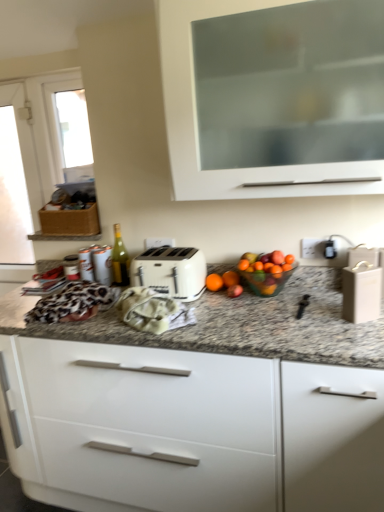
This screenshot has width=384, height=512. Describe the element at coordinates (120, 259) in the screenshot. I see `green glass bottle at center` at that location.

Find the location of `green glass bottle at center`. green glass bottle at center is located at coordinates (120, 259).

How much space does white plastic electric outlet at center, arranged as the first electric outlet when viewed from the back, occupy vertically?

white plastic electric outlet at center, arranged as the first electric outlet when viewed from the back, is 2.19 inches in height.

Measure the distance between point [303,252] and camera.

Point [303,252] and camera are 1.84 meters apart from each other.

At what (x,y) coordinates should I click in order to perform the action: click on white plastic electric outlet at upper right, which is counted as the first electric outlet, starting from the right. Please return your answer as a coordinate pair (x, y). The width and height of the screenshot is (384, 512). Looking at the image, I should click on (313, 248).

Locate an element on the screen. Image resolution: width=384 pixels, height=512 pixels. translucent glass bowl at center is located at coordinates (267, 271).

In order to face orange matte at center, should I rotate leftwards or rightwards?

Turn right approximately 4.250 degrees to face it.

Measure the distance between orange matte at center and camera.

5.83 feet.

Image resolution: width=384 pixels, height=512 pixels. In order to click on green glass bottle at center in this screenshot , I will do click(120, 259).

Which of these two, white matte cabinet at upper center, the 1th cabinetry viewed from the top, or beige matte wine box at right, the second appliance viewed from the back, is bigger?

Bigger between the two is white matte cabinet at upper center, the 1th cabinetry viewed from the top.

Is white matte cabinet at upper center, the 1th cabinetry viewed from the top, located outside beige matte wine box at right, which ranks as the 2th appliance in left-to-right order?

Yes, white matte cabinet at upper center, the 1th cabinetry viewed from the top, is not within beige matte wine box at right, which ranks as the 2th appliance in left-to-right order.

Considering the relative sizes of white matte cabinet at upper center, the 1th cabinetry viewed from the top, and beige matte wine box at right, the 1th appliance viewed from the front, in the image provided, is white matte cabinet at upper center, the 1th cabinetry viewed from the top, thinner than beige matte wine box at right, the 1th appliance viewed from the front,?

No, white matte cabinet at upper center, the 1th cabinetry viewed from the top, is not thinner than beige matte wine box at right, the 1th appliance viewed from the front.

Considering the sizes of objects white matte cabinet at upper center, the 1th cabinetry viewed from the top, and beige matte wine box at right, the second appliance viewed from the back, in the image provided, who is shorter, white matte cabinet at upper center, the 1th cabinetry viewed from the top, or beige matte wine box at right, the second appliance viewed from the back,?

beige matte wine box at right, the second appliance viewed from the back.

Consider the image. From the image's perspective, is beige matte wine box at right, the second appliance viewed from the back, below green glass bottle at center?

Yes.

At what (x,y) coordinates should I click in order to perform the action: click on bottle lying above the beige matte wine box at right, which ranks as the 2th appliance in left-to-right order (from the image's perspective). Please return your answer as a coordinate pair (x, y). The image size is (384, 512). Looking at the image, I should click on (120, 259).

Does beige matte wine box at right, the second appliance viewed from the back, have a lesser height compared to green glass bottle at center?

Yes.

From a real-world perspective, which object rests below the other?

beige matte wine box at right, which ranks as the 2th appliance in left-to-right order, from a real-world perspective.

Between leopard print fabric at center and beige matte wine box at right, the second appliance viewed from the back, which one appears on the right side from the viewer's perspective?

From the viewer's perspective, beige matte wine box at right, the second appliance viewed from the back, appears more on the right side.

How different are the orientations of leopard print fabric at center and beige matte wine box at right, which ranks as the 2th appliance in left-to-right order, in degrees?

They differ by 0.303 degrees in their facing directions.

From their relative heights in the image, would you say leopard print fabric at center is taller or shorter than beige matte wine box at right, the second appliance viewed from the back?

In the image, leopard print fabric at center appears to be shorter than beige matte wine box at right, the second appliance viewed from the back.

What are the coordinates of `fruit on the right of the green glass bottle at center` in the screenshot? It's located at (267, 271).

How different are the orientations of translucent glass bowl at center and green glass bottle at center in degrees?

translucent glass bowl at center and green glass bottle at center are facing 6.65e-05 degrees away from each other.

Considering the relative positions of translucent glass bowl at center and green glass bottle at center in the image provided, is translucent glass bowl at center to the left of green glass bottle at center from the viewer's perspective?

In fact, translucent glass bowl at center is to the right of green glass bottle at center.

Is translucent glass bowl at center turned away from green glass bottle at center?

No, translucent glass bowl at center is not facing the opposite direction of green glass bottle at center.

Which object is further away from the camera, white plastic toaster at center or green glass bottle at center?

green glass bottle at center.

Locate an element on the screen. This screenshot has width=384, height=512. toaster directly beneath the green glass bottle at center (from a real-world perspective) is located at coordinates (171, 271).

Considering the relative sizes of white plastic toaster at center and green glass bottle at center in the image provided, is white plastic toaster at center wider than green glass bottle at center?

Yes, white plastic toaster at center is wider than green glass bottle at center.

In terms of width, does white plastic toaster at center look wider or thinner when compared to white plastic electric outlet at upper right, the first electric outlet viewed from the front?

Considering their sizes, white plastic toaster at center looks broader than white plastic electric outlet at upper right, the first electric outlet viewed from the front.

Does white plastic toaster at center touch white plastic electric outlet at upper right, the second electric outlet when ordered from back to front?

No, white plastic toaster at center is not touching white plastic electric outlet at upper right, the second electric outlet when ordered from back to front.

Does white plastic toaster at center come behind white plastic electric outlet at upper right, the second electric outlet when ordered from back to front?

No, white plastic toaster at center is closer to the camera.

Can you tell me how much white plastic toaster at center and white plastic electric outlet at upper right, placed as the 2th electric outlet when sorted from left to right, differ in facing direction?

The angular difference between white plastic toaster at center and white plastic electric outlet at upper right, placed as the 2th electric outlet when sorted from left to right, is 0.00856 degrees.

Consider the image. Considering the positions of objects orange matte at center and metallic silver canister at left, arranged as the 2th appliance when viewed from the front, in the image provided, who is in front, orange matte at center or metallic silver canister at left, arranged as the 2th appliance when viewed from the front,?

orange matte at center is in front.

Which object is wider, orange matte at center or metallic silver canister at left, which is the 1th appliance in back-to-front order?

metallic silver canister at left, which is the 1th appliance in back-to-front order, is wider.

From a real-world perspective, is orange matte at center under metallic silver canister at left, which is the 1th appliance in back-to-front order?

Indeed, from a real-world perspective, orange matte at center is positioned beneath metallic silver canister at left, which is the 1th appliance in back-to-front order.

What's the angular difference between orange matte at center and metallic silver canister at left, which appears as the first appliance when viewed from the left,'s facing directions?

They differ by 0.00118 degrees in their facing directions.

Which cabinetry is the 1st one when counting from the left side of the beige matte wine box at right, positioned as the first appliance in right-to-left order? Please provide its 2D coordinates.

[(273, 97)]

From a real-world perspective, starting from the green glass bottle at center, which appliance is the 1st one below it? Please provide its 2D coordinates.

[(362, 285)]

Looking at the image, which one is located further to white glossy cabinet at center, marked as the 1th cabinetry in a bottom-to-top arrangement, beige matte wine box at right, the 1th appliance viewed from the front, or translucent glass bowl at center?

beige matte wine box at right, the 1th appliance viewed from the front.

When comparing their distances from leopard print fabric at center, does transparent glass window at upper left or white plastic electric outlet at center, the second electric outlet in the right-to-left sequence, seem further?

transparent glass window at upper left.

Looking at the image, which one is located further to translucent glass bowl at center, leopard print fabric at center or transparent glass window at upper left?

The object further to translucent glass bowl at center is transparent glass window at upper left.

From the image, which object appears to be farther from green glass bottle at center, metallic silver canister at left, which appears as the first appliance when viewed from the left, or beige matte wine box at right, the second appliance viewed from the back?

beige matte wine box at right, the second appliance viewed from the back.

From the image, which object appears to be farther from white plastic electric outlet at upper right, the second electric outlet when ordered from back to front, metallic silver canister at left, which is the 1th appliance in back-to-front order, or green glass bottle at center?

metallic silver canister at left, which is the 1th appliance in back-to-front order, lies further to white plastic electric outlet at upper right, the second electric outlet when ordered from back to front, than the other object.

Estimate the real-world distances between objects in this image. Which object is further from translucent glass bowl at center, white plastic electric outlet at upper right, which is counted as the first electric outlet, starting from the right, or white matte cabinet at upper center, which appears as the 2th cabinetry when ordered from the bottom?

Among the two, white matte cabinet at upper center, which appears as the 2th cabinetry when ordered from the bottom, is located further to translucent glass bowl at center.

From the image, which object appears to be nearer to white glossy cabinet at center, which is counted as the second cabinetry, starting from the top, white plastic electric outlet at upper right, the first electric outlet viewed from the front, or white plastic electric outlet at center, the second electric outlet in the right-to-left sequence?

white plastic electric outlet at center, the second electric outlet in the right-to-left sequence, is positioned closer to the anchor white glossy cabinet at center, which is counted as the second cabinetry, starting from the top.

When comparing their distances from metallic silver canister at left, which is the 1th appliance in back-to-front order, does white plastic toaster at center or transparent glass window at upper left seem closer?

white plastic toaster at center.

Where is `cabinetry between white glossy cabinet at center, which is counted as the second cabinetry, starting from the top, and metallic silver canister at left, which is the 1th appliance in back-to-front order, in the front-back direction`? cabinetry between white glossy cabinet at center, which is counted as the second cabinetry, starting from the top, and metallic silver canister at left, which is the 1th appliance in back-to-front order, in the front-back direction is located at coordinates (273, 97).

Image resolution: width=384 pixels, height=512 pixels. Find the location of `bottle between transparent glass window at upper left and metallic silver canister at left, which appears as the first appliance when viewed from the left, vertically`. bottle between transparent glass window at upper left and metallic silver canister at left, which appears as the first appliance when viewed from the left, vertically is located at coordinates (120, 259).

The height and width of the screenshot is (512, 384). Find the location of `bottle between white glossy cabinet at center, which is counted as the second cabinetry, starting from the top, and transparent glass window at upper left in the front-back direction`. bottle between white glossy cabinet at center, which is counted as the second cabinetry, starting from the top, and transparent glass window at upper left in the front-back direction is located at coordinates (120, 259).

Find the location of `appliance between white glossy cabinet at center, marked as the 1th cabinetry in a bottom-to-top arrangement, and white plastic electric outlet at upper right, which is counted as the first electric outlet, starting from the right, in the front-back direction`. appliance between white glossy cabinet at center, marked as the 1th cabinetry in a bottom-to-top arrangement, and white plastic electric outlet at upper right, which is counted as the first electric outlet, starting from the right, in the front-back direction is located at coordinates (362, 285).